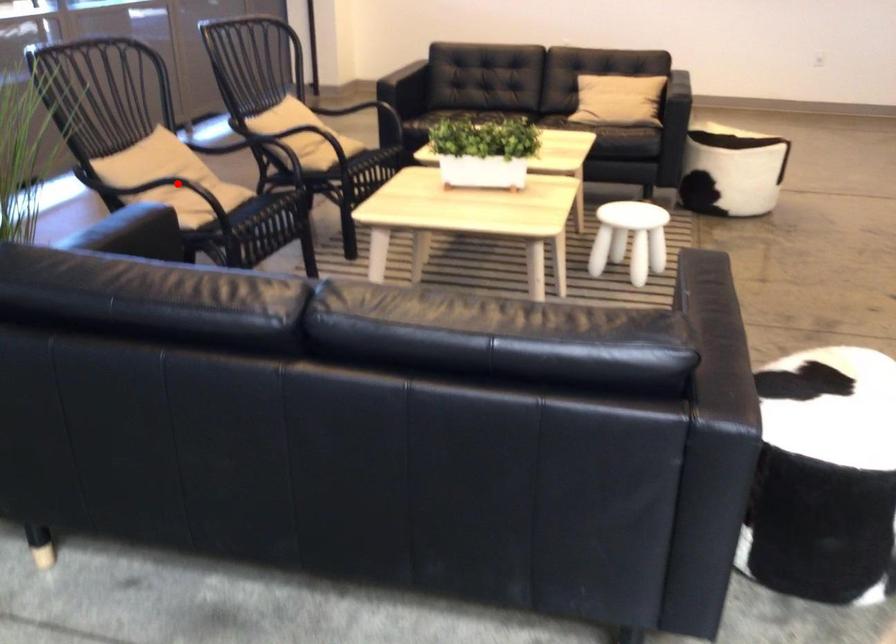
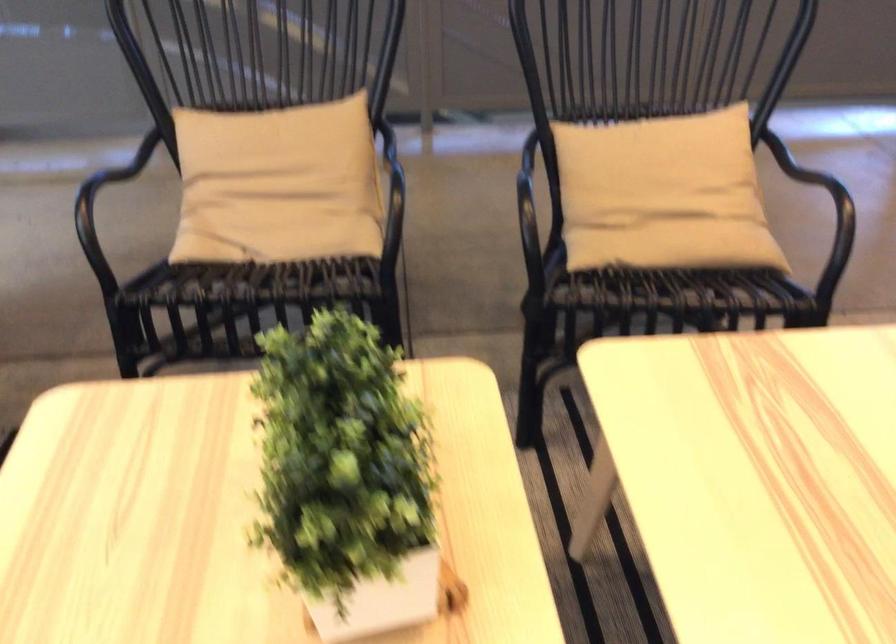
In the second image, find the point that corresponds to the highlighted location in the first image.

(278, 184)